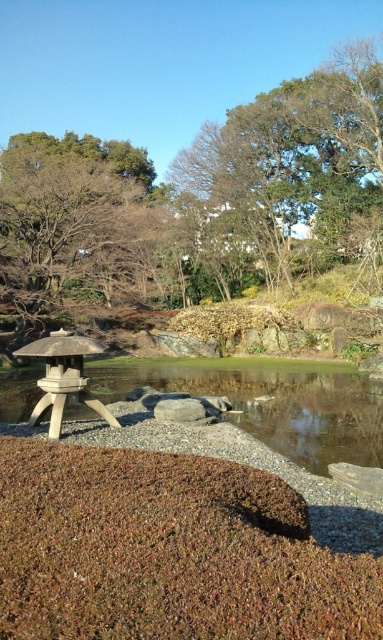
You are a visitor in the Japanese garden and want to cross from the gravel path to the other side. The only path available is between the clear water at center and the smooth gray rock at center. Can you step over this obstacle without getting your shoes wet?

The clear water at center is taller than the smooth gray rock at center, so stepping over might be difficult as the water is higher. It is advisable to avoid getting your shoes wet by finding another path.

You are standing at the center of the gravel path in the Japanese garden scene. You want to place a new decorative rock exactly where the stone lantern at lower left is currently located. According to the image, what are the 2D coordinates where you should place the rock?

The stone lantern at lower left is located at coordinates (x=63, y=378), so you should place the decorative rock at those exact coordinates.